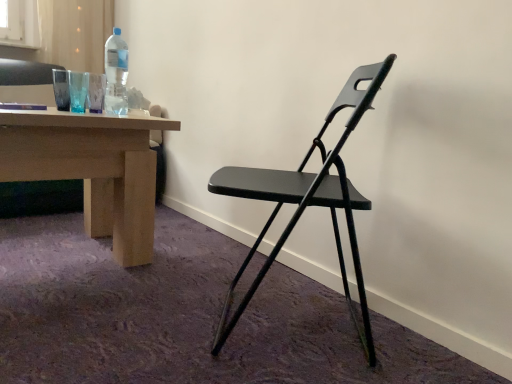
Question: Do you think matte black folding chair at center is within transparent plastic bottle at upper left, or outside of it?

Choices:
 (A) inside
 (B) outside

Answer: (B)

Question: From a real-world perspective, is matte black folding chair at center physically located above or below transparent plastic bottle at upper left?

Choices:
 (A) below
 (B) above

Answer: (A)

Question: Considering the positions of matte black folding chair at center and transparent plastic bottle at upper left in the image, is matte black folding chair at center taller or shorter than transparent plastic bottle at upper left?

Choices:
 (A) short
 (B) tall

Answer: (B)

Question: Does point (114, 84) appear closer or farther from the camera than point (322, 173)?

Choices:
 (A) farther
 (B) closer

Answer: (A)

Question: Based on their positions, is transparent plastic bottle at upper left located to the left or right of matte black folding chair at center?

Choices:
 (A) left
 (B) right

Answer: (A)

Question: Relative to matte black folding chair at center, is transparent plastic bottle at upper left in front or behind?

Choices:
 (A) front
 (B) behind

Answer: (B)

Question: Looking at the image, does transparent plastic bottle at upper left seem bigger or smaller compared to matte black folding chair at center?

Choices:
 (A) big
 (B) small

Answer: (B)